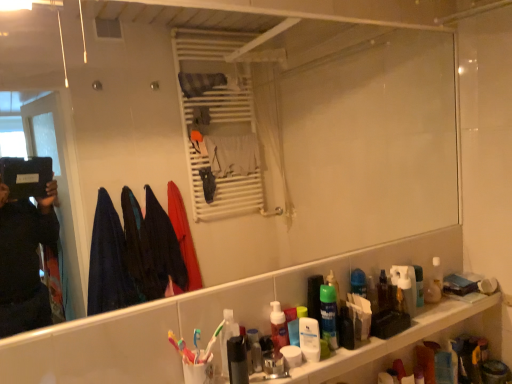
This screenshot has width=512, height=384. I want to click on free location to the right of white plastic mouthwash at lower center, which is counted as the 5th mouthwash, starting from the right, so click(350, 352).